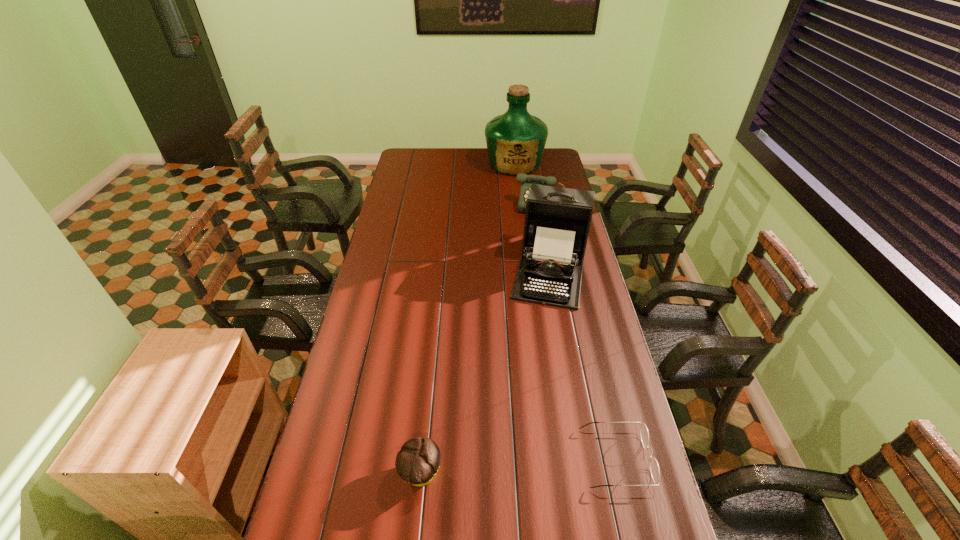
Image resolution: width=960 pixels, height=540 pixels. Identify the location of the leftmost object. (417, 462).

Image resolution: width=960 pixels, height=540 pixels. Find the location of `the fourth tallest object`. the fourth tallest object is located at coordinates (417, 462).

Locate an element on the screen. This screenshot has height=540, width=960. the shortest object is located at coordinates (653, 464).

What are the coordinates of `typewriter` in the screenshot? It's located at (557, 220).

This screenshot has width=960, height=540. What are the coordinates of `the third farthest object` in the screenshot? It's located at (557, 220).

Find the location of `telephone`. telephone is located at coordinates (526, 180).

Identify the location of the fourth nearest object. (526, 180).

You are a GUI agent. You are given a task and a screenshot of the screen. Output one action in this format:
    pyautogui.click(x=<x>, y=<y>)
    Task: Click on the farthest object
    
    Given the screenshot: What is the action you would take?
    pyautogui.click(x=515, y=140)

At what (x,y) coordinates should I click in order to perform the action: click on liquor. Please return your answer as a coordinate pair (x, y). Image resolution: width=960 pixels, height=540 pixels. Looking at the image, I should click on (515, 140).

The height and width of the screenshot is (540, 960). Identify the location of vacant area located 0.280m on the right of the muffin. (547, 474).